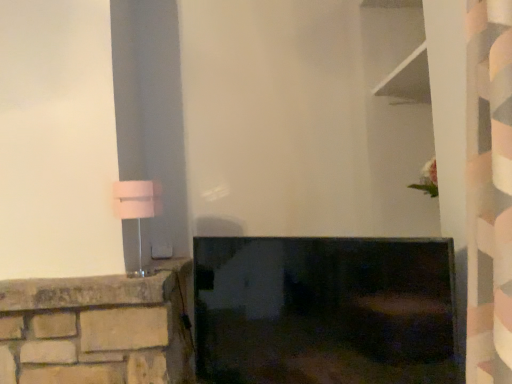
Question: Is pink fabric lampshade at left spatially inside matte black tv at center, or outside of it?

Choices:
 (A) inside
 (B) outside

Answer: (B)

Question: Considering the positions of pink fabric lampshade at left and matte black tv at center in the image, is pink fabric lampshade at left wider or thinner than matte black tv at center?

Choices:
 (A) thin
 (B) wide

Answer: (B)

Question: Looking at the image, does pink fabric lampshade at left seem bigger or smaller compared to matte black tv at center?

Choices:
 (A) small
 (B) big

Answer: (A)

Question: From their relative heights in the image, would you say matte black tv at center is taller or shorter than pink fabric lampshade at left?

Choices:
 (A) tall
 (B) short

Answer: (A)

Question: Do you think matte black tv at center is within pink fabric lampshade at left, or outside of it?

Choices:
 (A) outside
 (B) inside

Answer: (A)

Question: Relative to pink fabric lampshade at left, is matte black tv at center in front or behind?

Choices:
 (A) front
 (B) behind

Answer: (A)

Question: From a real-world perspective, is matte black tv at center physically located above or below pink fabric lampshade at left?

Choices:
 (A) above
 (B) below

Answer: (B)